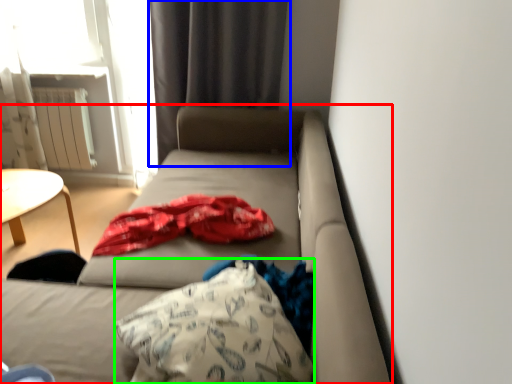
Question: Estimate the real-world distances between objects in this image. Which object is farther from studio couch (highlighted by a red box), curtain (highlighted by a blue box) or throw pillow (highlighted by a green box)?

Choices:
 (A) curtain
 (B) throw pillow

Answer: (A)